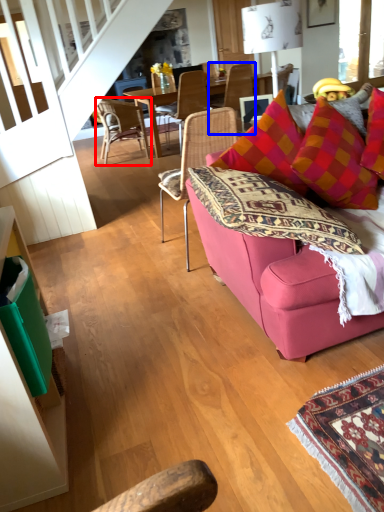
Question: Which point is closer to the camera, chair (highlighted by a red box) or chair (highlighted by a blue box)?

Choices:
 (A) chair
 (B) chair

Answer: (A)